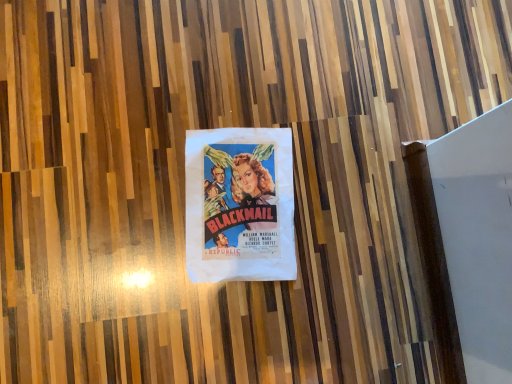
In order to face white paper poster at center, should I rotate leftwards or rightwards?

Rotate your view left by about 1.952°.

What is the approximate width of white paper poster at center?

It is 30.04 centimeters.

At what (x,y) coordinates should I click in order to perform the action: click on white paper poster at center. Please return your answer as a coordinate pair (x, y). Looking at the image, I should click on (240, 205).

What do you see at coordinates (240, 205) in the screenshot?
I see `white paper poster at center` at bounding box center [240, 205].

Image resolution: width=512 pixels, height=384 pixels. What are the coordinates of `white paper poster at center` in the screenshot? It's located at (240, 205).